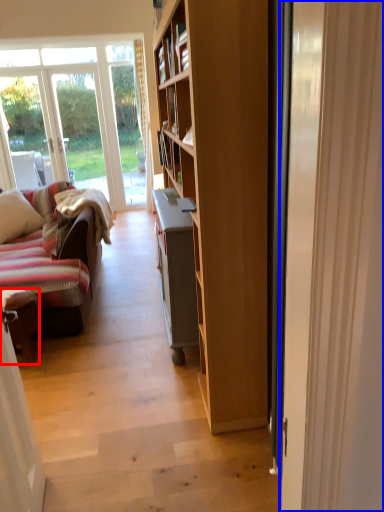
Question: Among these objects, which one is nearest to the camera, chair (highlighted by a red box) or door (highlighted by a blue box)?

Choices:
 (A) chair
 (B) door

Answer: (B)